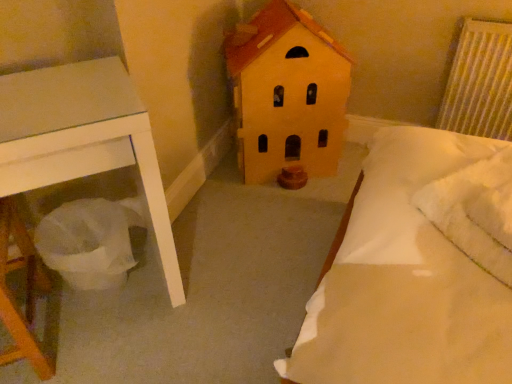
Question: Can you confirm if white textured radiator at upper right is thinner than white fluffy pillow at upper right?

Choices:
 (A) yes
 (B) no

Answer: (A)

Question: Considering the relative sizes of white textured radiator at upper right and white fluffy pillow at upper right in the image provided, is white textured radiator at upper right shorter than white fluffy pillow at upper right?

Choices:
 (A) yes
 (B) no

Answer: (B)

Question: From the image's perspective, does white textured radiator at upper right appear lower than white fluffy pillow at upper right?

Choices:
 (A) yes
 (B) no

Answer: (B)

Question: Is the surface of white textured radiator at upper right in direct contact with white fluffy pillow at upper right?

Choices:
 (A) no
 (B) yes

Answer: (A)

Question: From a real-world perspective, is white textured radiator at upper right physically above white fluffy pillow at upper right?

Choices:
 (A) yes
 (B) no

Answer: (B)

Question: From a real-world perspective, is matte yellow house at center positioned above or below white fluffy pillow at upper right?

Choices:
 (A) above
 (B) below

Answer: (B)

Question: In the image, is matte yellow house at center positioned in front of or behind white fluffy pillow at upper right?

Choices:
 (A) behind
 (B) front

Answer: (A)

Question: Is matte yellow house at center to the left or to the right of white fluffy pillow at upper right in the image?

Choices:
 (A) right
 (B) left

Answer: (B)

Question: From the image's perspective, is matte yellow house at center above or below white fluffy pillow at upper right?

Choices:
 (A) below
 (B) above

Answer: (B)

Question: In terms of size, does white textured radiator at upper right appear bigger or smaller than matte yellow house at center?

Choices:
 (A) big
 (B) small

Answer: (B)

Question: From the image's perspective, is white textured radiator at upper right positioned above or below matte yellow house at center?

Choices:
 (A) below
 (B) above

Answer: (B)

Question: Considering the positions of point (452, 89) and point (293, 46), is point (452, 89) closer or farther from the camera than point (293, 46)?

Choices:
 (A) closer
 (B) farther

Answer: (B)

Question: Considering the relative positions of white textured radiator at upper right and matte yellow house at center in the image provided, is white textured radiator at upper right to the left or to the right of matte yellow house at center?

Choices:
 (A) right
 (B) left

Answer: (A)

Question: Is matte yellow house at center situated inside white textured radiator at upper right or outside?

Choices:
 (A) outside
 (B) inside

Answer: (A)

Question: Does point (337, 59) appear closer or farther from the camera than point (489, 107)?

Choices:
 (A) closer
 (B) farther

Answer: (A)